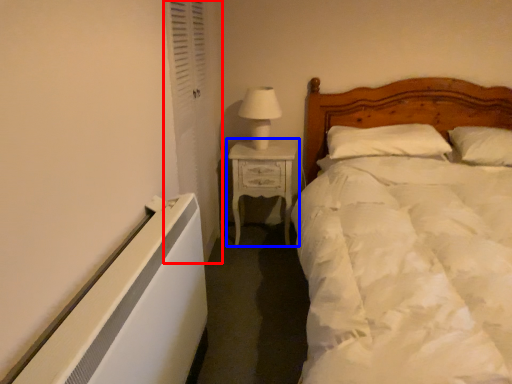
Question: Among these objects, which one is nearest to the camera, curtain (highlighted by a red box) or nightstand (highlighted by a blue box)?

Choices:
 (A) curtain
 (B) nightstand

Answer: (A)